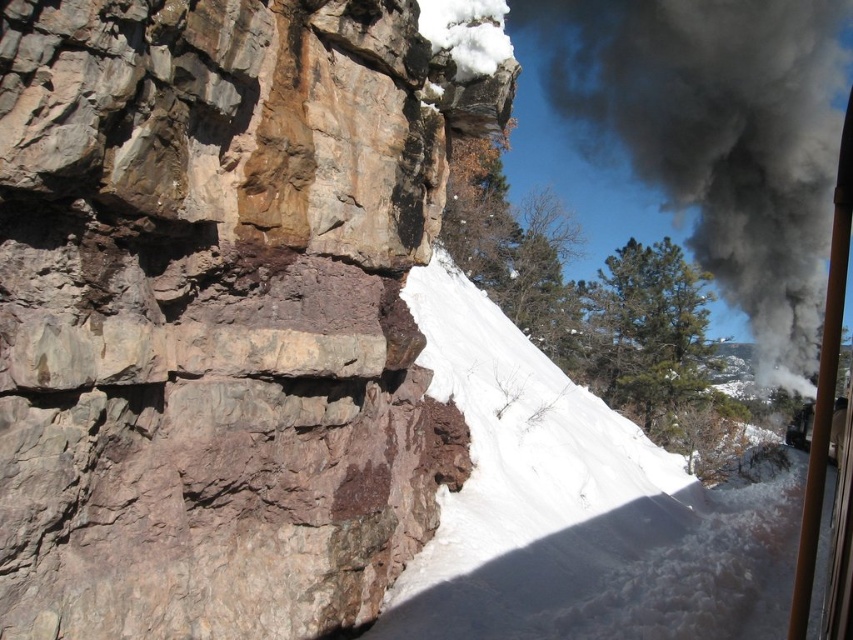
The image size is (853, 640). Describe the element at coordinates (218, 310) in the screenshot. I see `rusty stone cliff at center` at that location.

Does rusty stone cliff at center have a greater width compared to white snow at center?

No.

Which is in front, point (386, 148) or point (558, 372)?

Positioned in front is point (386, 148).

In order to click on rusty stone cliff at center in this screenshot , I will do `click(218, 310)`.

Can you confirm if white snow at center is positioned to the left of black smoke at upper right?

Correct, you'll find white snow at center to the left of black smoke at upper right.

Consider the image. Is white snow at center further to the viewer compared to black smoke at upper right?

No, white snow at center is in front of black smoke at upper right.

Describe the element at coordinates (567, 506) in the screenshot. I see `white snow at center` at that location.

I want to click on white snow at center, so click(567, 506).

Does rusty stone cliff at center appear under black smoke at upper right?

Correct, rusty stone cliff at center is located below black smoke at upper right.

Between rusty stone cliff at center and black smoke at upper right, which one appears on the left side from the viewer's perspective?

From the viewer's perspective, rusty stone cliff at center appears more on the left side.

Between point (80, 484) and point (741, 200), which one is positioned in front?

Point (80, 484) is in front.

Find the location of a particular element. The height and width of the screenshot is (640, 853). rusty stone cliff at center is located at coordinates (218, 310).